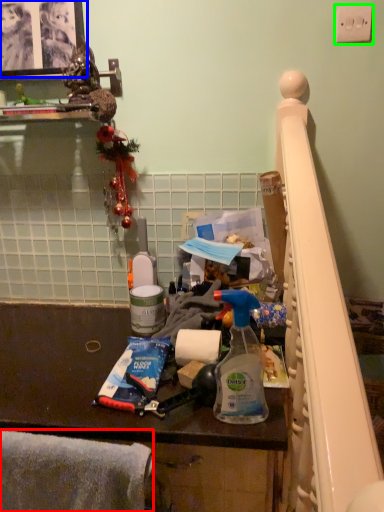
Question: Which is nearer to the blanket (highlighted by a red box)? picture frame (highlighted by a blue box) or light switch (highlighted by a green box).

Choices:
 (A) picture frame
 (B) light switch

Answer: (A)